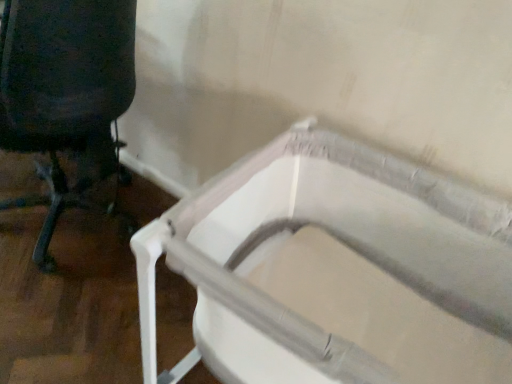
Identify the location of free spot below black fabric chair at left (from a real-world perspective). (67, 221).